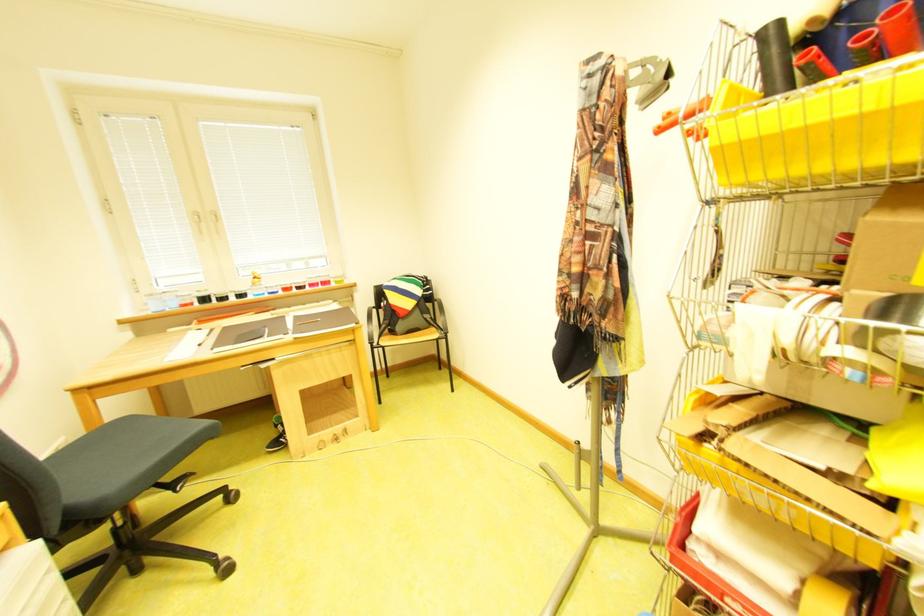
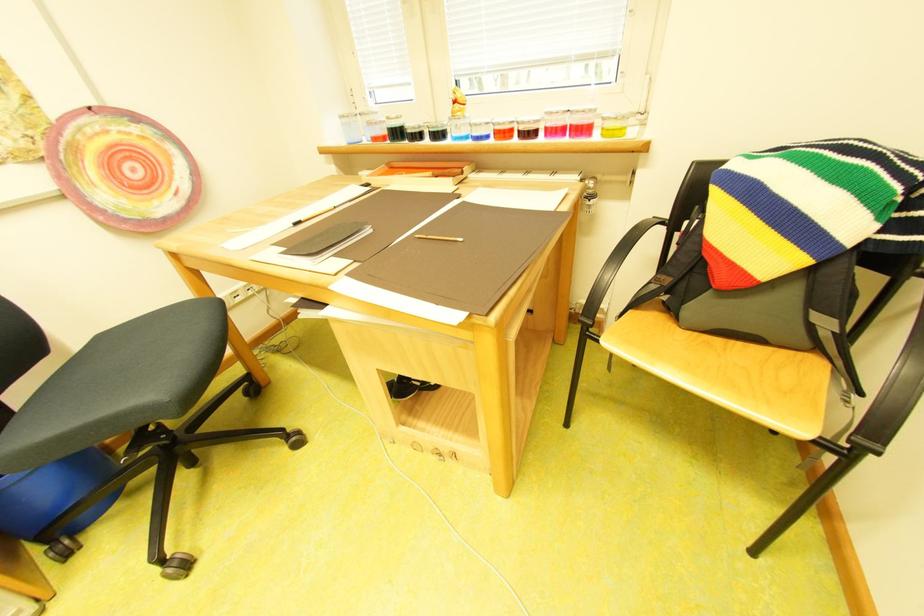
The point at (289,293) is marked in the first image. Where is the corresponding point in the second image?

(499, 138)